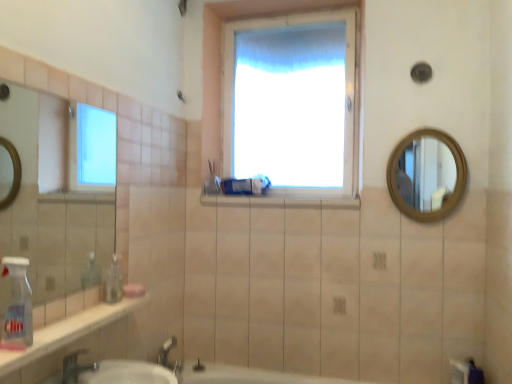
Question: In terms of height, does white glossy window sill at center look taller or shorter compared to silver metallic faucet at lower left?

Choices:
 (A) tall
 (B) short

Answer: (B)

Question: Looking at their shapes, would you say white glossy window sill at center is wider or thinner than silver metallic faucet at lower left?

Choices:
 (A) thin
 (B) wide

Answer: (B)

Question: Which object is positioned closest to the wooden round mirror at upper right?

Choices:
 (A) white plastic bottle at lower left
 (B) white glossy window sill at center
 (C) matte plastic toothbrush at center
 (D) silver metallic faucet at lower left
 (E) pink matte soap at lower left

Answer: (B)

Question: Estimate the real-world distances between objects in this image. Which object is closer to the wooden round mirror at upper right?

Choices:
 (A) pink matte soap at lower left
 (B) white glossy window sill at center
 (C) matte plastic toothbrush at center
 (D) white plastic bottle at lower left
 (E) silver metallic faucet at lower left

Answer: (B)